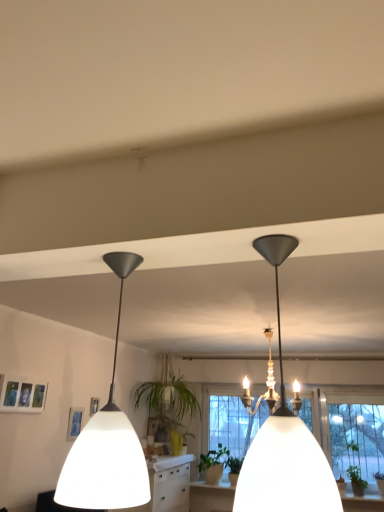
Question: Can you confirm if white matte lampshade at center, which ranks as the 1th lamp in right-to-left order, is thinner than green leafy plant at lower right, the 1th plant when ordered from front to back?

Choices:
 (A) yes
 (B) no

Answer: (A)

Question: Can you confirm if white matte lampshade at center, placed as the second lamp when sorted from left to right, is taller than green leafy plant at lower right, marked as the second plant in a back-to-front arrangement?

Choices:
 (A) no
 (B) yes

Answer: (B)

Question: Can you confirm if white matte lampshade at center, placed as the second lamp when sorted from left to right, is smaller than green leafy plant at lower right, the 1th plant when ordered from front to back?

Choices:
 (A) yes
 (B) no

Answer: (B)

Question: Is white matte lampshade at center, placed as the second lamp when sorted from left to right, oriented towards green leafy plant at lower right, the 2th plant in the left-to-right sequence?

Choices:
 (A) no
 (B) yes

Answer: (A)

Question: Is white matte lampshade at center, placed as the second lamp when sorted from left to right, wider than green leafy plant at lower right, the 2th plant in the left-to-right sequence?

Choices:
 (A) no
 (B) yes

Answer: (A)

Question: From the image's perspective, relative to white matte pendant light at left, the first lamp viewed from the left, is green matte plant at center, the 2th plant positioned from the front, above or below?

Choices:
 (A) above
 (B) below

Answer: (B)

Question: Which is correct: green matte plant at center, marked as the 2th plant in a right-to-left arrangement, is inside white matte pendant light at left, marked as the 2th lamp in a right-to-left arrangement, or outside of it?

Choices:
 (A) outside
 (B) inside

Answer: (A)

Question: Is green matte plant at center, the 1th plant from the back, bigger or smaller than white matte pendant light at left, the first lamp viewed from the left?

Choices:
 (A) small
 (B) big

Answer: (A)

Question: Relative to white matte pendant light at left, marked as the 2th lamp in a right-to-left arrangement, is green matte plant at center, the 1th plant from the back, in front or behind?

Choices:
 (A) behind
 (B) front

Answer: (A)

Question: Looking at their shapes, would you say green matte plant at center, marked as the 2th plant in a right-to-left arrangement, is wider or thinner than green leafy plant at lower right, the 2th plant in the left-to-right sequence?

Choices:
 (A) wide
 (B) thin

Answer: (B)

Question: In the image, is green matte plant at center, the 1th plant from the back, on the left side or the right side of green leafy plant at lower right, positioned as the first plant in right-to-left order?

Choices:
 (A) left
 (B) right

Answer: (A)

Question: Considering their positions, is green matte plant at center, the 2th plant positioned from the front, located in front of or behind green leafy plant at lower right, the 2th plant in the left-to-right sequence?

Choices:
 (A) behind
 (B) front

Answer: (A)

Question: Does point (226, 456) appear closer or farther from the camera than point (347, 471)?

Choices:
 (A) closer
 (B) farther

Answer: (B)

Question: Considering the relative positions of white matte pendant light at left, marked as the 2th lamp in a right-to-left arrangement, and green matte plant at center, the 1th plant when ordered from left to right, in the image provided, is white matte pendant light at left, marked as the 2th lamp in a right-to-left arrangement, to the left or to the right of green matte plant at center, the 1th plant when ordered from left to right,?

Choices:
 (A) left
 (B) right

Answer: (A)

Question: Considering the positions of white matte pendant light at left, the first lamp viewed from the left, and green matte plant at center, the 1th plant from the back, in the image, is white matte pendant light at left, the first lamp viewed from the left, wider or thinner than green matte plant at center, the 1th plant from the back,?

Choices:
 (A) wide
 (B) thin

Answer: (B)